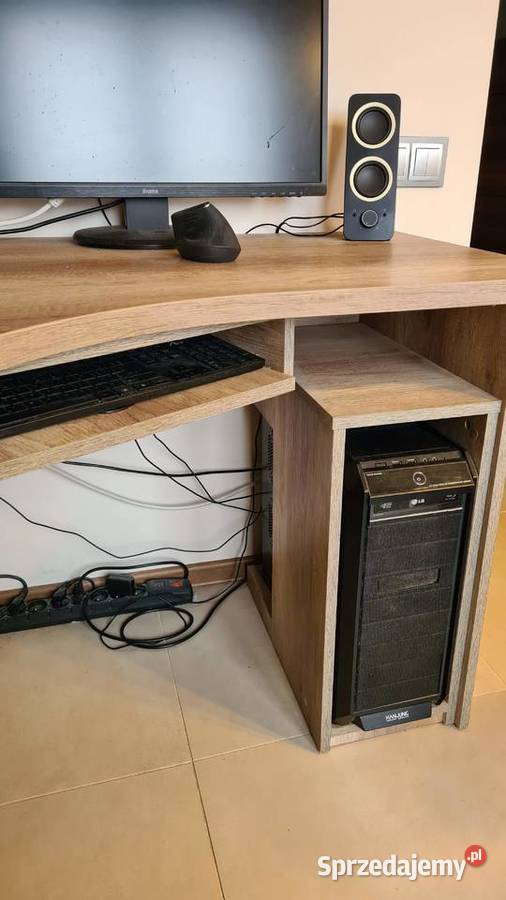
Image resolution: width=506 pixels, height=900 pixels. I want to click on wires, so click(x=165, y=446), click(x=193, y=504), click(x=198, y=472), click(x=231, y=580).